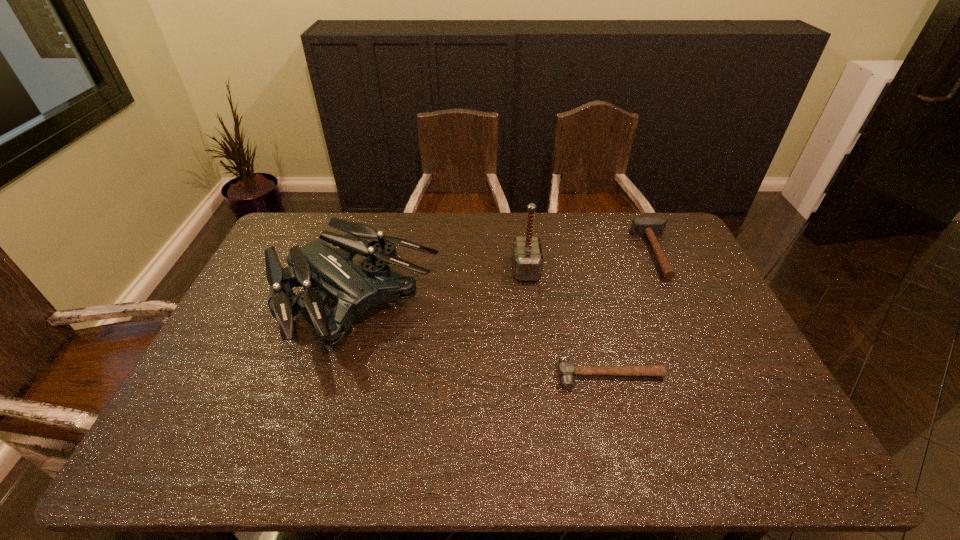
The height and width of the screenshot is (540, 960). I want to click on free space at the right edge of the desktop, so tap(683, 284).

The width and height of the screenshot is (960, 540). Find the location of `vacant region at the far left corner of the desktop`. vacant region at the far left corner of the desktop is located at coordinates (288, 240).

Find the location of `empty space that is in between the tallest hammer and the second shortest hammer`. empty space that is in between the tallest hammer and the second shortest hammer is located at coordinates (592, 261).

Where is `unoccupied position between the rightmost hammer and the nearest hammer`? This screenshot has height=540, width=960. unoccupied position between the rightmost hammer and the nearest hammer is located at coordinates (635, 314).

Identify the location of free area in between the leftmost object and the tallest hammer. (440, 288).

The height and width of the screenshot is (540, 960). I want to click on vacant area that lies between the shortest hammer and the tallest object, so click(x=568, y=322).

You are a GUI agent. You are given a task and a screenshot of the screen. Output one action in this format:
    pyautogui.click(x=<x>, y=<y>)
    Task: Click on the empty location between the drone and the shortest object
    The image size is (960, 540).
    Given the screenshot: What is the action you would take?
    pyautogui.click(x=482, y=341)

Find the location of a particular element. The image size is (960, 540). free space between the shortest object and the drone is located at coordinates (482, 341).

Find the location of a particular element. The height and width of the screenshot is (540, 960). vacant space that is in between the third tallest object and the tallest hammer is located at coordinates (592, 261).

This screenshot has height=540, width=960. I want to click on vacant region between the leftmost hammer and the rightmost object, so click(x=592, y=261).